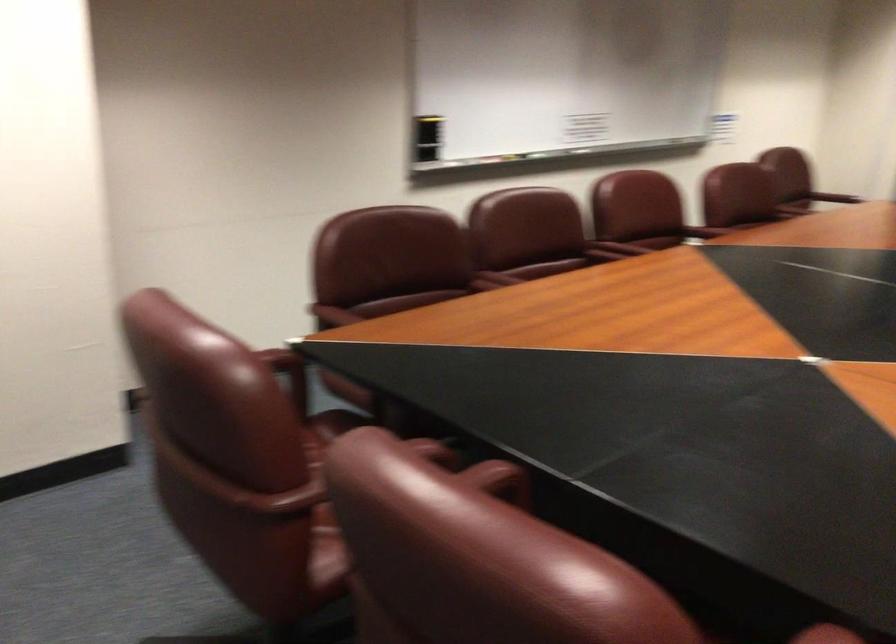
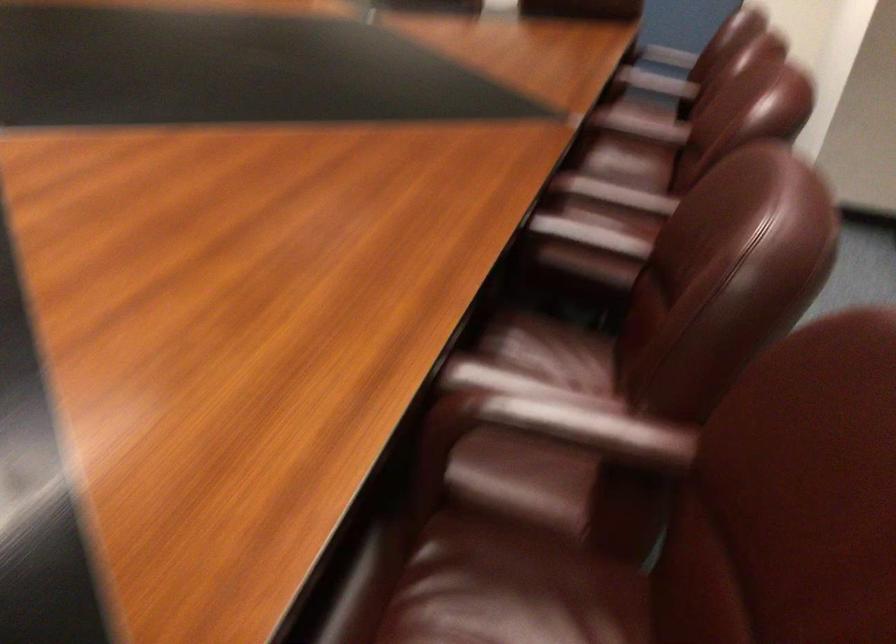
Where in the second image is the point corresponding to point (795, 185) from the first image?

(579, 428)